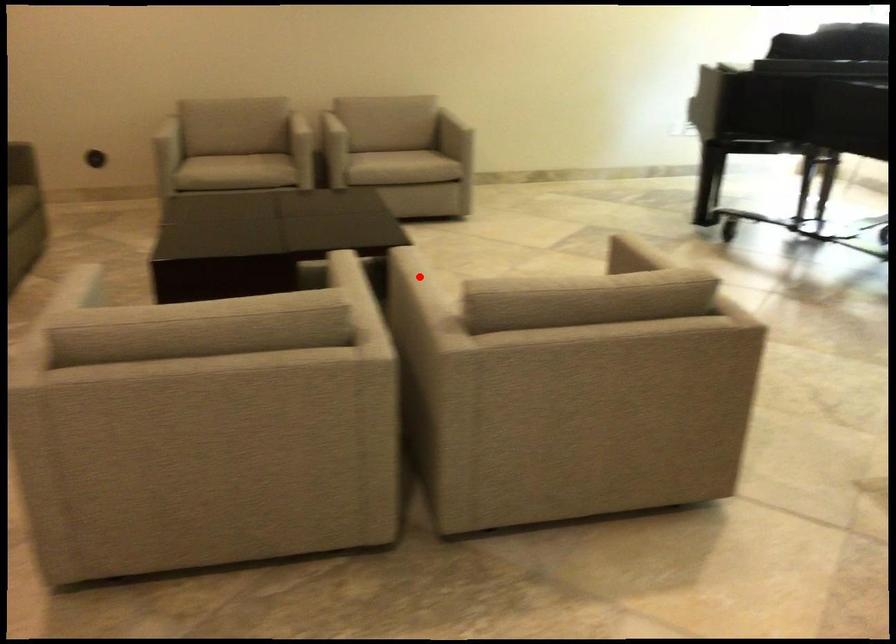
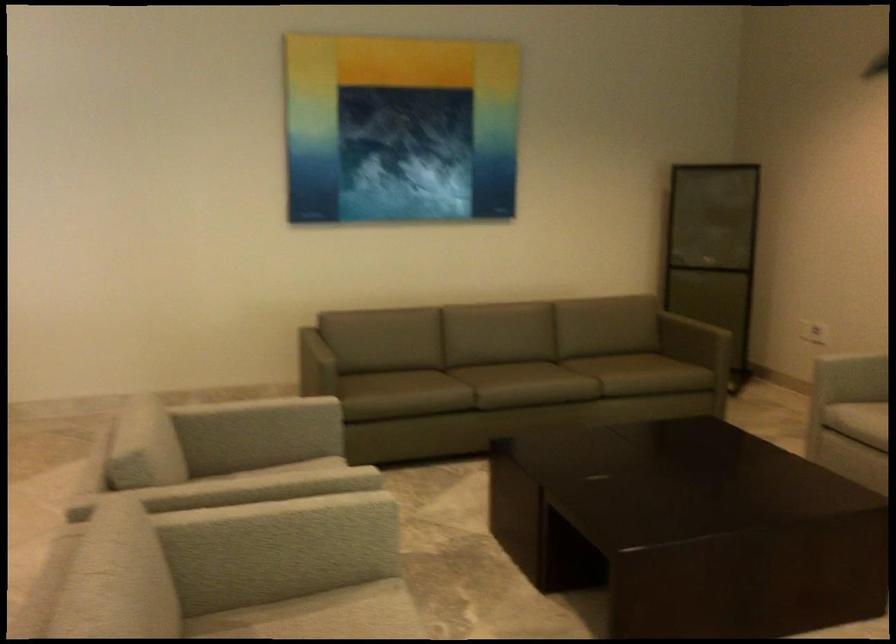
Question: I am providing you with two images of the same scene from different viewpoints. Given a red point in image1, look at the same physical point in image2. Is it:

Choices:
 (A) Closer to the viewpoint
 (B) Farther from the viewpoint

Answer: (A)